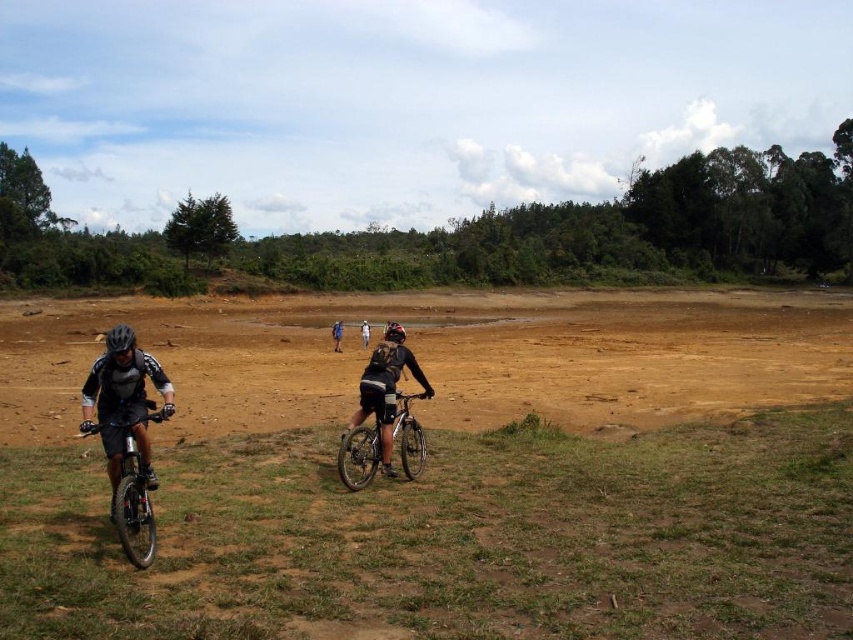
You are a cyclist in the scene and want to reach the point marked as point (363, 321). You are currently at point (337, 451). Given the terrain, which direction should you head to reach your destination?

Since point (337, 451) is in front of point (363, 321), you should move backward to reach point (363, 321).

You are a photographer trying to capture both the silver metallic bicycle at center and the black matte helmet at center in a single shot. Based on their sizes in the image, which object would appear closer to the camera?

The silver metallic bicycle at center appears smaller than the black matte helmet at center, so the black matte helmet at center is closer to the camera.

You are a photographer trying to capture a shot of the blue fabric shorts at center and the black matte bicycle helmet at left. Based on their positions, which object is located to the right of the other?

The blue fabric shorts at center is located to the right of the black matte bicycle helmet at left.